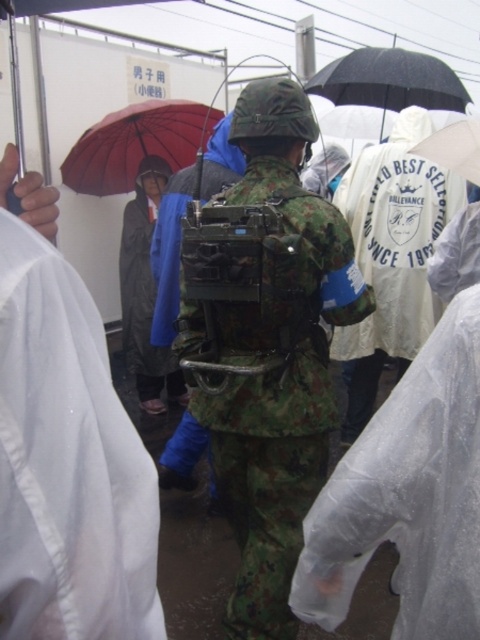
Question: Is red matte umbrella at upper left smaller than black matte umbrella at upper center?

Choices:
 (A) yes
 (B) no

Answer: (A)

Question: Can you confirm if camouflage fabric backpack at center is bigger than white matte umbrella at upper center?

Choices:
 (A) no
 (B) yes

Answer: (B)

Question: Which object appears closest to the camera in this image?

Choices:
 (A) black matte umbrella at upper center
 (B) red matte umbrella at upper left
 (C) camouflage fabric backpack at center
 (D) white matte umbrella at upper center

Answer: (C)

Question: Which object is positioned closest to the camouflage fabric backpack at center?

Choices:
 (A) black matte umbrella at upper center
 (B) white matte umbrella at upper center

Answer: (B)

Question: Can you confirm if black matte umbrella at upper center is wider than white matte umbrella at upper center?

Choices:
 (A) no
 (B) yes

Answer: (B)

Question: Which point is closer to the camera taking this photo?

Choices:
 (A) (92, 125)
 (B) (471, 134)

Answer: (B)